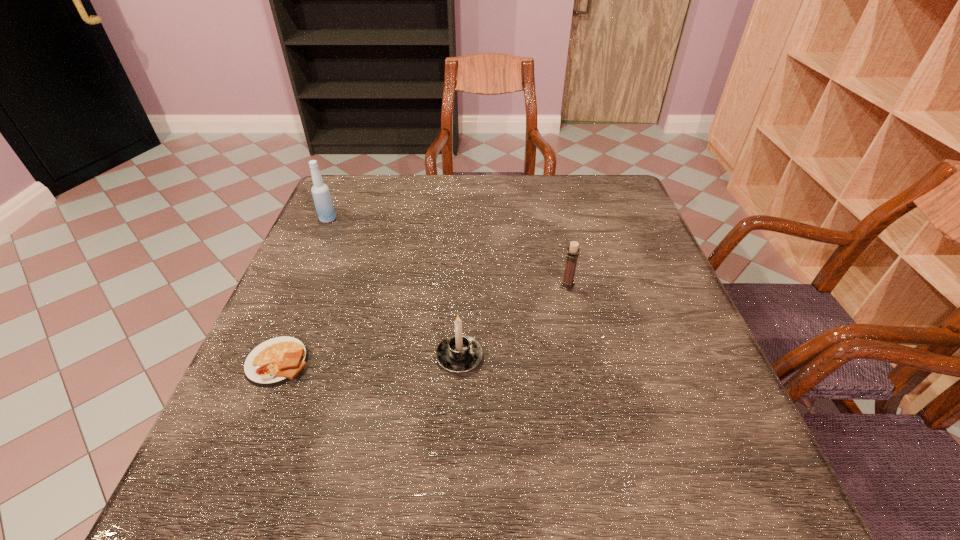
The width and height of the screenshot is (960, 540). I want to click on free space that is in between the farthest object and the right candle holder, so click(x=447, y=253).

Image resolution: width=960 pixels, height=540 pixels. What are the coordinates of `unoccupied area between the second farthest object and the second object from right to left` in the screenshot? It's located at (514, 321).

This screenshot has width=960, height=540. Identify the location of vacant area between the bottle and the left candle holder. point(394,288).

Identify which object is the closest to the third nearest object. Please provide its 2D coordinates. Your answer should be formatted as a tuple, i.e. [(x, y)], where the tuple contains the x and y coordinates of a point satisfying the conditions above.

[(458, 353)]

Point out which object is positioned as the third nearest to the right candle holder. Please provide its 2D coordinates. Your answer should be formatted as a tuple, i.e. [(x, y)], where the tuple contains the x and y coordinates of a point satisfying the conditions above.

[(324, 206)]

Locate an element on the screen. The height and width of the screenshot is (540, 960). free region that satisfies the following two spatial constraints: 1. on the back side of the shortest object; 2. on the right side of the right candle holder is located at coordinates (310, 286).

Identify the location of vacant area in the image that satisfies the following two spatial constraints: 1. with a handle on the side of the left candle holder; 2. on the left side of the rightmost object. Image resolution: width=960 pixels, height=540 pixels. click(x=463, y=286).

Locate an element on the screen. The width and height of the screenshot is (960, 540). vacant space that satisfies the following two spatial constraints: 1. on the back side of the omelet; 2. on the right side of the right candle holder is located at coordinates (310, 286).